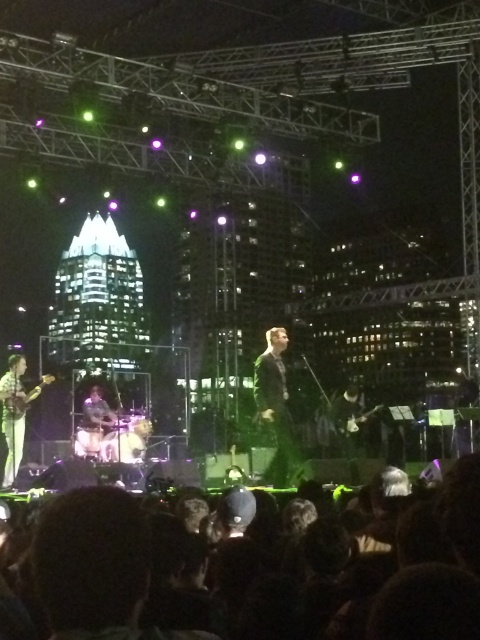
You are a photographer at the concert. You want to capture a photo of the dark hair at lower center and the shiny silver guitar at left in the same frame. Which object should you focus on first if you want to ensure both are in focus?

The dark hair at lower center has a larger width than the shiny silver guitar at left, so you should focus on the dark hair at lower center first to ensure both are in focus.

You are a photographer standing at the back of the concert venue. You want to take a photo of the dark hair at lower center and the shiny silver guitar at left. Given that your camera has a maximum focus range of 40 meters, will you be able to capture both subjects clearly in the same photo?

The dark hair at lower center is 41.45 meters away from the shiny silver guitar at left. Since the camera can only focus up to 40 meters, it cannot capture both subjects clearly in the same photo because the distance between them exceeds the camera s maximum focus range.